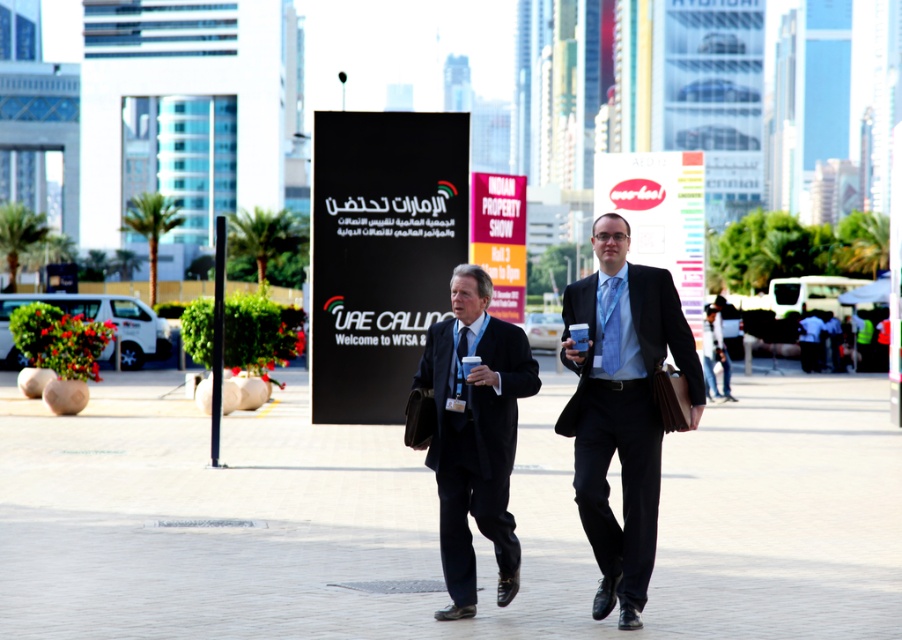
You are a photographer standing at the base of the black plastic sign at center. You want to take a photo of the two people walking in the foreground. How far apart are the two people from each other?

The two people are 17.78 meters apart.

You are a pedestrian standing in the urban setting shown. You see both the black plastic sign at center and the matte pink sign at center. Which sign is nearer to you?

The black plastic sign at center is closer to the viewer than the matte pink sign at center.